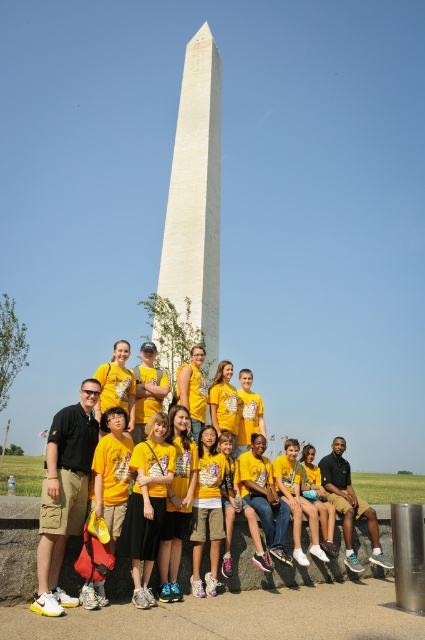
You are a photographer standing in front of the Washington Monument. You notice a group of people wearing yellow cotton shirts sitting on a stone wall. Which object in the scene is taller, the yellow cotton shirt at center or the white marble obelisk at center?

The white marble obelisk at center is taller than the yellow cotton shirt at center.

You are a photographer standing at the location where the yellow cotton shirt at center is positioned. The white marble obelisk at center is the main subject of your photo. To ensure the obelisk is in focus, you need to adjust your camera settings so that the distance between you and the obelisk is exactly 25 meters. Is the current distance sufficient for your requirements?

The yellow cotton shirt at center is 25.78 meters from the white marble obelisk at center. Since 25.78 meters is slightly more than 25 meters, the current distance is sufficient to meet the requirement of being exactly 25 meters.

You are a photographer standing at the center of the Washington Monument scene. You want to focus your camera on the yellow cotton shirt at center. According to the coordinates provided, where should you aim your camera?

The yellow cotton shirt at center is located at the 2D coordinates point (98, 492), so you should aim your camera at that specific coordinate point to focus on it.